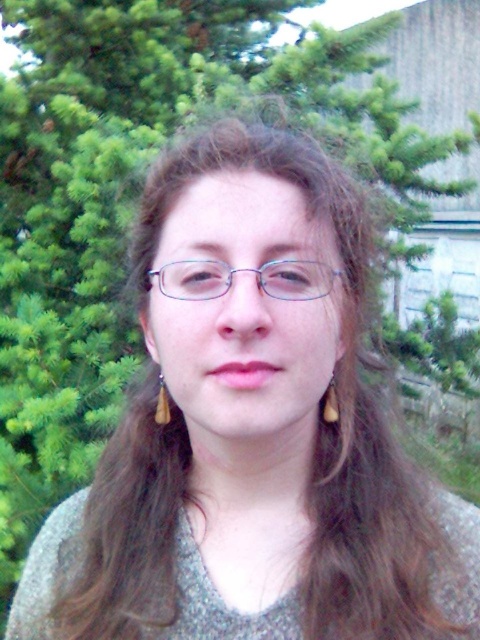
Question: Among these points, which one is nearest to the camera?

Choices:
 (A) (259, 284)
 (B) (167, 420)
 (C) (337, 406)

Answer: (A)

Question: Does brown leather earring at lower right appear over brown leather earring at left?

Choices:
 (A) yes
 (B) no

Answer: (B)

Question: Which of the following is the closest to the observer?

Choices:
 (A) (165, 396)
 (B) (335, 410)
 (C) (288, 275)

Answer: (C)

Question: Is brown leather earring at lower right closer to the viewer compared to brown leather earring at left?

Choices:
 (A) no
 (B) yes

Answer: (B)

Question: In this image, where is clear plastic glasses at center located relative to brown leather earring at left?

Choices:
 (A) right
 (B) left

Answer: (A)

Question: Which point is closer to the camera?

Choices:
 (A) (160, 374)
 (B) (215, 275)
 (C) (326, 410)

Answer: (B)